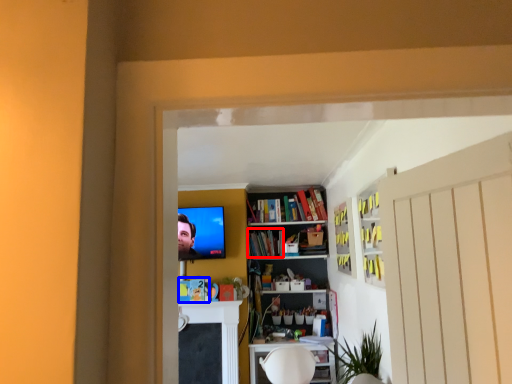
Question: Which of the following is the farthest to the observer, book (highlighted by a red box) or book (highlighted by a blue box)?

Choices:
 (A) book
 (B) book

Answer: (A)